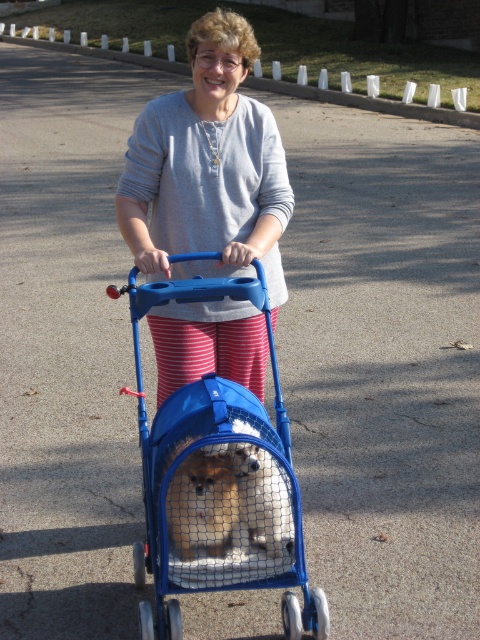
You are a photographer standing 2 meters away from the camera. You want to take a photo of the gray cotton sweater at center. Can you reach the sweater to adjust its position without moving closer than 1 meter from your current position?

The gray cotton sweater at center is 3.60 meters from the camera. Since you are currently 2 meters away from the camera, you would need to move to within 1.60 meters to reach it. However, you cannot move closer than 1 meter from your current position, so you cannot reach the sweater without moving closer.

You are a delivery robot trying to reach the gray cotton sweater at center. The robot has a width of 0.2 meters. The coordinates of the gray cotton sweater at center are at point (207, 166). Can you fit through the space to reach it?

The gray cotton sweater at center is located at point (207, 166). Since the robot is 0.2 meters wide, it can navigate to the coordinates and reach the gray cotton sweater at center as the space is sufficient for its width.

You are a delivery person who needs to place both the gray cotton sweater at center and the blue plastic pet carrier at center into a storage box. The box has a height limit of 1 meter. Can both items be placed in the box without exceeding the height limit?

The gray cotton sweater at center is taller than the blue plastic pet carrier at center. Since the box has a height limit of 1 meter, both items can be placed in the box as long as their combined height does not exceed the limit. However, since the sweater is taller than the carrier, we need to know their individual heights to determine if they fit together. The description only states the relative height between them, not their exact measurements. Therefore, it is uncertain if both can fit without more inf